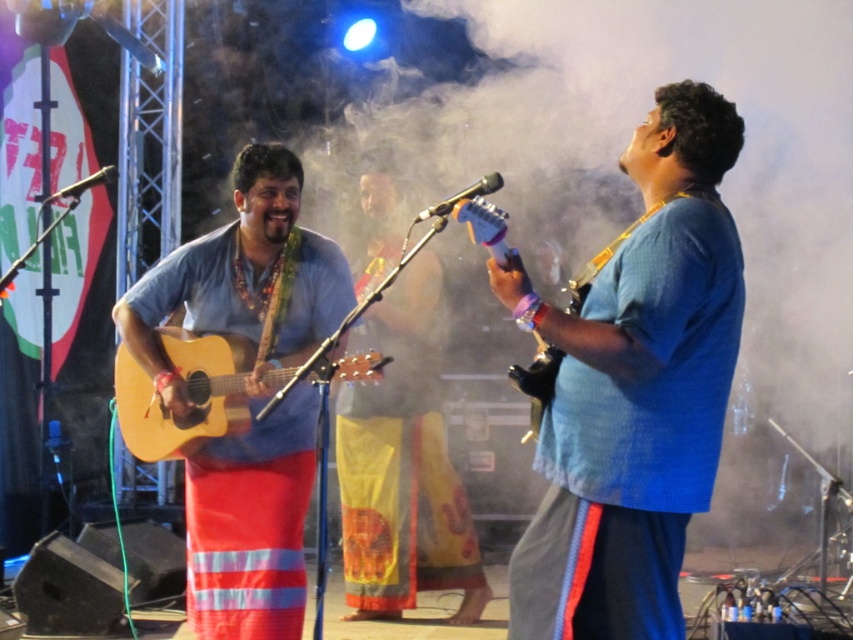
Looking at this image, you are a stagehand who needs to place a new spotlight. You see two points marked on the stage. The first point is at coordinate point (717, 224) and the second point is at coordinate point (318, 285). Which point is closer to the audience?

Point (717, 224) is in front of point (318, 285), so it is closer to the audience.

You are a photographer at the back of the stage. You want to take a photo of the blue cotton shirt at center and the matte wood guitar at center. Which object should you focus on first if you want to capture both in the same frame without moving the camera?

The blue cotton shirt at center is taller than the matte wood guitar at center, so you should focus on the blue cotton shirt at center first to ensure it is in focus before the shorter guitar.